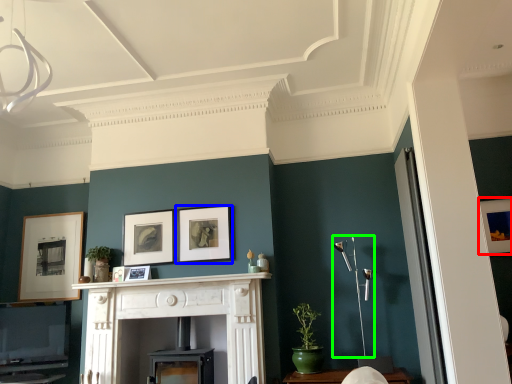
Question: Which object is the farthest from picture frame (highlighted by a red box)? Choose among these: picture frame (highlighted by a blue box) or light fixture (highlighted by a green box).

Choices:
 (A) picture frame
 (B) light fixture

Answer: (A)